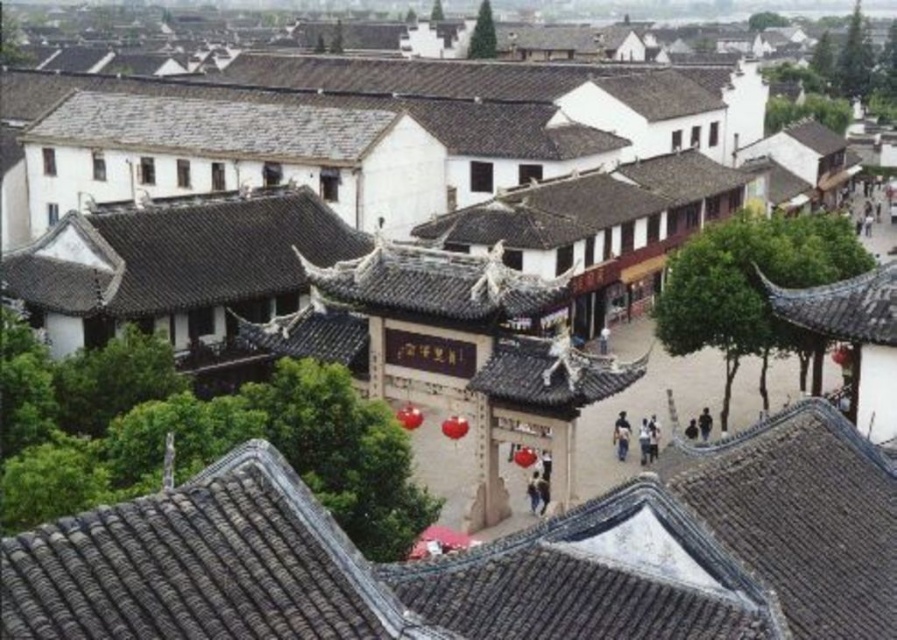
You are standing at the entrance of the complex and want to locate the gray tile roof at center. According to the coordinates provided, where should you look relative to your current position?

The gray tile roof at center is located at coordinates point (490, 556), which means it is positioned to the right and slightly above your current line of sight.

You are a tourist standing in front of the stone archway. You notice two roofs in the scene. Which roof is closer to you, the gray tile roof at center or the shiny dark gray roof at upper right?

→ The gray tile roof at center is closer to you because it is in front of the shiny dark gray roof at upper right.

You are standing in the traditional Chinese architectural scene and want to locate the shiny dark gray roof at upper right. Based on the gray tile roof at center, which direction should you look to find it?

The gray tile roof at center is to the left of shiny dark gray roof at upper right, so you should look to the right of the gray tile roof at center to find the shiny dark gray roof at upper right.